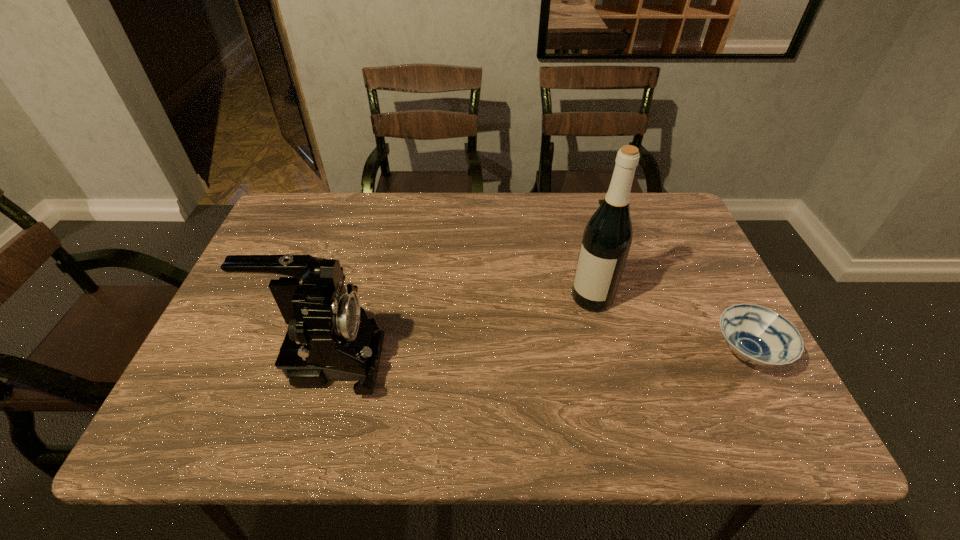
Identify the location of object that is at the near left corner. (330, 338).

Locate an element on the screen. object located at the far right corner is located at coordinates (600, 200).

Locate an element on the screen. The width and height of the screenshot is (960, 540). object that is positioned at the near right corner is located at coordinates (758, 335).

Where is `vacant space at the far edge`? The width and height of the screenshot is (960, 540). vacant space at the far edge is located at coordinates (394, 228).

This screenshot has width=960, height=540. In the image, there is a desktop. Identify the location of vacant space at the near edge. (698, 398).

In the image, there is a desktop. What are the coordinates of `free space at the left edge` in the screenshot? It's located at tap(275, 299).

In the image, there is a desktop. Where is `free space at the right edge`? The height and width of the screenshot is (540, 960). free space at the right edge is located at coordinates point(674,287).

This screenshot has height=540, width=960. What are the coordinates of `vacant space at the far left corner of the desktop` in the screenshot? It's located at (309, 214).

Locate an element on the screen. free space at the near right corner of the desktop is located at coordinates (702, 389).

Identify the location of free spot between the soup bowl and the second farthest object. The height and width of the screenshot is (540, 960). (669, 325).